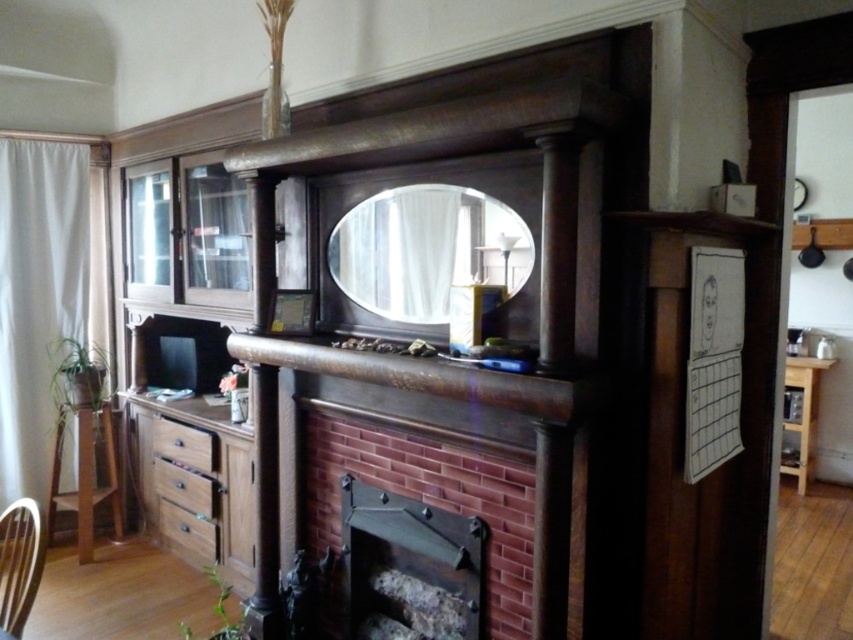
Is point (9, 513) farther from viewer compared to point (177, 504)?

No, (9, 513) is in front of (177, 504).

In the scene shown: Is the position of wooden slatted chair at lower left less distant than that of wooden drawer at lower left?

Yes, wooden slatted chair at lower left is in front of wooden drawer at lower left.

What are the coordinates of `wooden slatted chair at lower left` in the screenshot? It's located at (19, 564).

What do you see at coordinates (426, 250) in the screenshot? Image resolution: width=853 pixels, height=640 pixels. I see `clear glass mirror at center` at bounding box center [426, 250].

Which is behind, point (395, 275) or point (213, 554)?

Point (213, 554)

I want to click on clear glass mirror at center, so click(x=426, y=250).

Which is above, brick fireplace at center or brown wood drawer at lower left?

brown wood drawer at lower left is above.

Is point (466, 605) farther from camera compared to point (158, 442)?

No, (466, 605) is closer to viewer.

Where is `brick fireplace at center`? This screenshot has width=853, height=640. brick fireplace at center is located at coordinates (409, 566).

The height and width of the screenshot is (640, 853). I want to click on brick fireplace at center, so click(x=409, y=566).